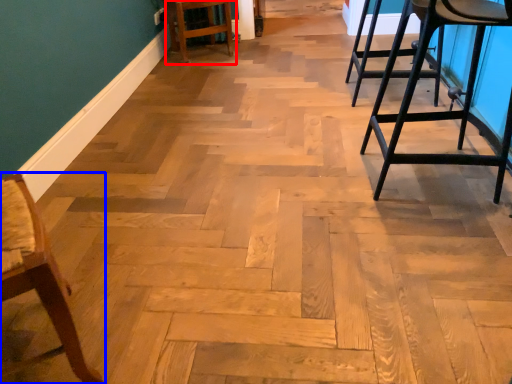
Question: Among these objects, which one is nearest to the camera, bar stool (highlighted by a red box) or chair (highlighted by a blue box)?

Choices:
 (A) bar stool
 (B) chair

Answer: (B)